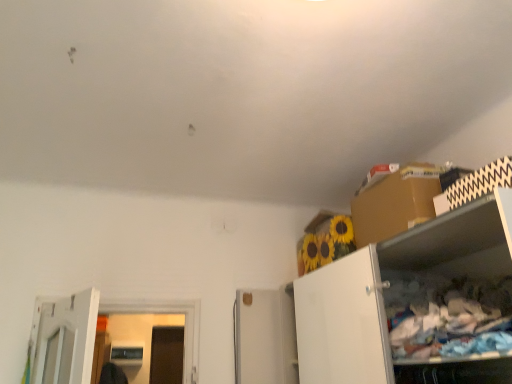
Question: Does white matte cabinet at right come behind brown cardboard box at upper right?

Choices:
 (A) no
 (B) yes

Answer: (A)

Question: Can you confirm if white matte cabinet at right is smaller than brown cardboard box at upper right?

Choices:
 (A) no
 (B) yes

Answer: (A)

Question: Does white matte cabinet at right have a greater height compared to brown cardboard box at upper right?

Choices:
 (A) yes
 (B) no

Answer: (A)

Question: Is white matte cabinet at right oriented away from brown cardboard box at upper right?

Choices:
 (A) no
 (B) yes

Answer: (A)

Question: From a real-world perspective, is white matte cabinet at right positioned under brown cardboard box at upper right based on gravity?

Choices:
 (A) no
 (B) yes

Answer: (B)

Question: Can you confirm if white matte cabinet at right is shorter than brown cardboard box at upper right?

Choices:
 (A) yes
 (B) no

Answer: (B)

Question: Is brown cardboard box at upper right looking in the opposite direction of white matte cabinet at right?

Choices:
 (A) no
 (B) yes

Answer: (A)

Question: Is brown cardboard box at upper right bigger than white matte cabinet at right?

Choices:
 (A) no
 (B) yes

Answer: (A)

Question: Is brown cardboard box at upper right shorter than white matte cabinet at right?

Choices:
 (A) yes
 (B) no

Answer: (A)

Question: Is brown cardboard box at upper right completely or partially outside of white matte cabinet at right?

Choices:
 (A) no
 (B) yes

Answer: (B)

Question: From the image's perspective, is brown cardboard box at upper right beneath white matte cabinet at right?

Choices:
 (A) no
 (B) yes

Answer: (A)

Question: Does brown cardboard box at upper right have a greater width compared to white matte cabinet at right?

Choices:
 (A) no
 (B) yes

Answer: (A)

Question: Is point (306, 337) positioned closer to the camera than point (370, 221)?

Choices:
 (A) closer
 (B) farther

Answer: (B)